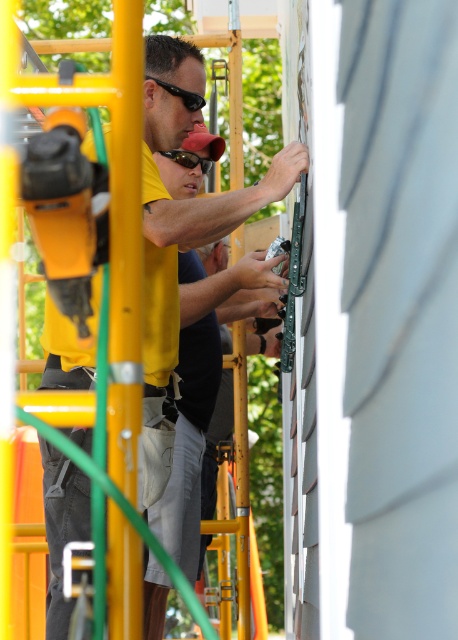
Question: Can you confirm if black plastic goggles at center is thinner than black plastic goggles at upper center?

Choices:
 (A) no
 (B) yes

Answer: (B)

Question: Is yellow matte shirt at center wider than black plastic goggles at center?

Choices:
 (A) yes
 (B) no

Answer: (B)

Question: Which of the following is the closest to the observer?

Choices:
 (A) (196, 100)
 (B) (70, 44)

Answer: (A)

Question: Is yellow matte shirt at center smaller than black plastic goggles at upper center?

Choices:
 (A) no
 (B) yes

Answer: (A)

Question: Which point is farther to the camera?

Choices:
 (A) (192, 157)
 (B) (259, 280)

Answer: (A)

Question: Considering the real-world distances, which object is farthest from the yellow matte shirt at center?

Choices:
 (A) black plastic goggles at center
 (B) black plastic goggles at upper center

Answer: (A)